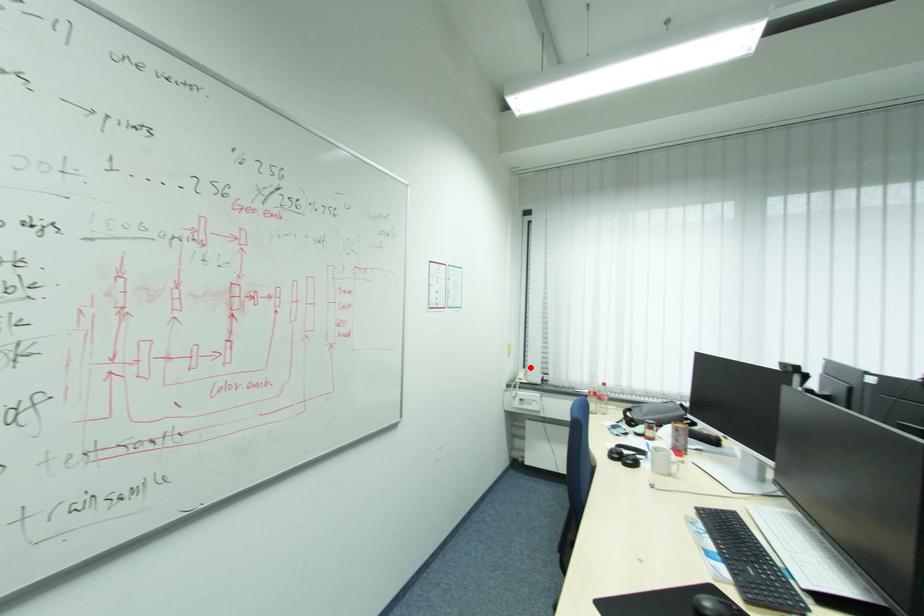
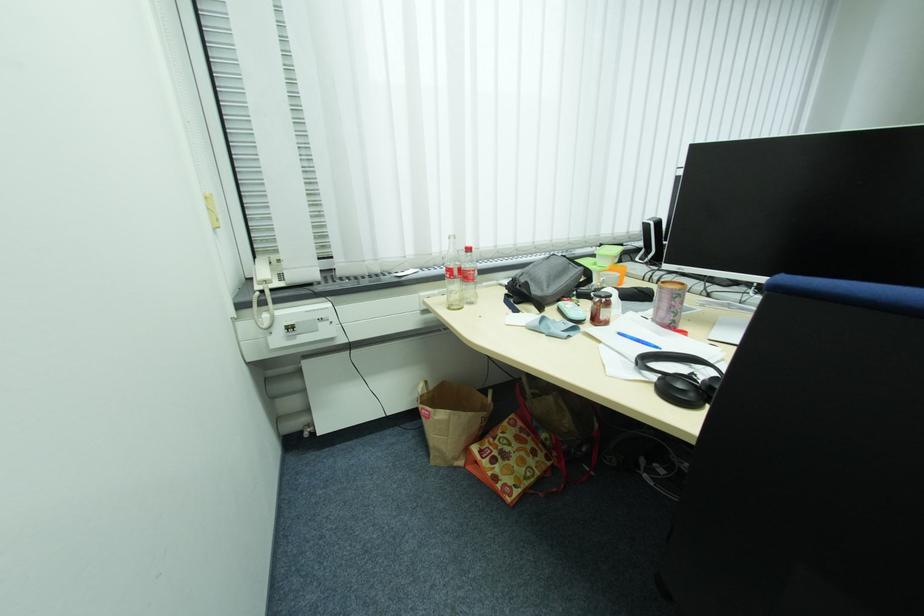
Question: I am providing you with two images of the same scene from different viewpoints. Given a red point in image1, look at the same physical point in image2. Is it:

Choices:
 (A) Closer to the viewpoint
 (B) Farther from the viewpoint

Answer: (A)